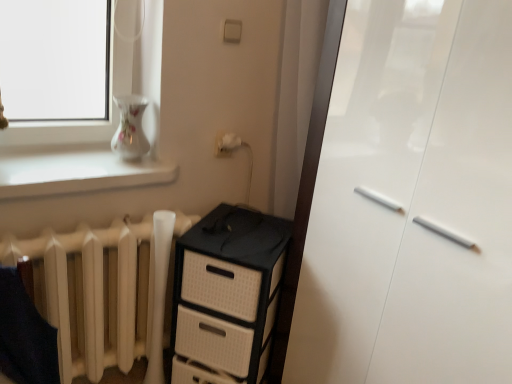
Question: Is white glossy cabinet at right situated inside black plastic chest of drawers at center or outside?

Choices:
 (A) outside
 (B) inside

Answer: (A)

Question: Is white glossy cabinet at right in front of or behind black plastic chest of drawers at center in the image?

Choices:
 (A) behind
 (B) front

Answer: (B)

Question: Which object is positioned farthest from the white matte radiator at lower left?

Choices:
 (A) white glossy cabinet at right
 (B) black plastic chest of drawers at center
 (C) white glossy vase at upper left

Answer: (A)

Question: Considering the real-world distances, which object is farthest from the black plastic chest of drawers at center?

Choices:
 (A) white glossy cabinet at right
 (B) white matte radiator at lower left
 (C) white glossy vase at upper left

Answer: (C)